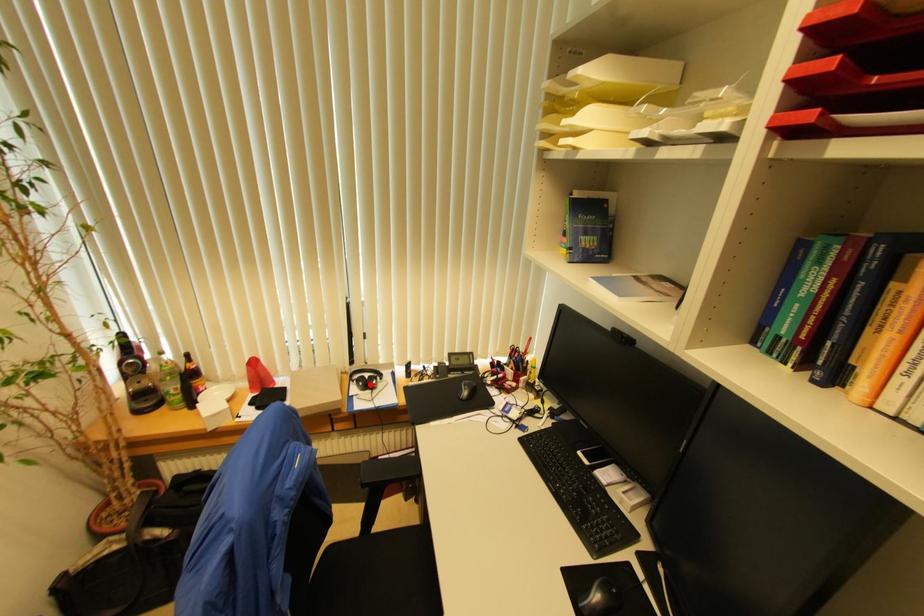
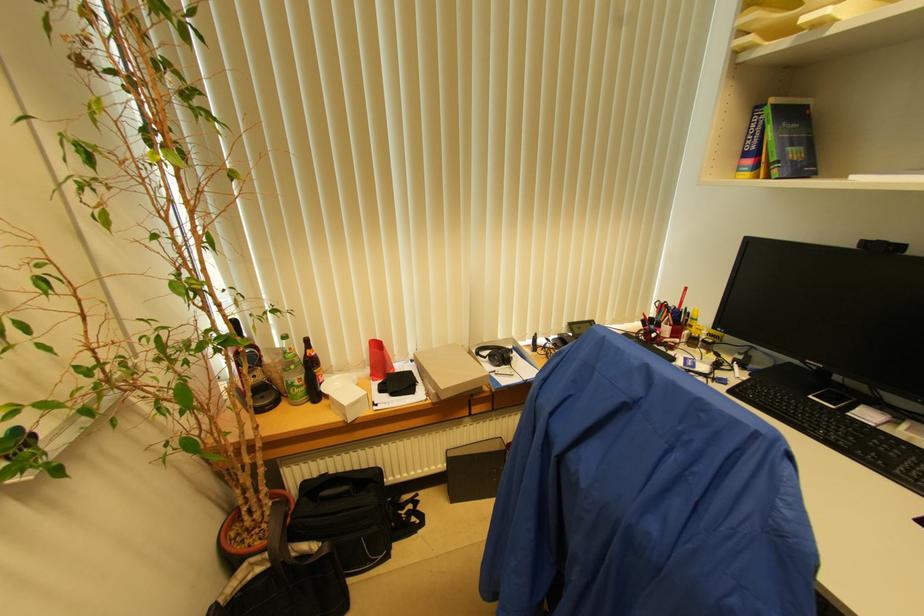
Question: I am providing you with two images of the same scene from different viewpoints. A red point is shown in image1. For the corresponding object point in image2, is it positioned nearer or farther from the camera?

Choices:
 (A) Nearer
 (B) Farther

Answer: (B)